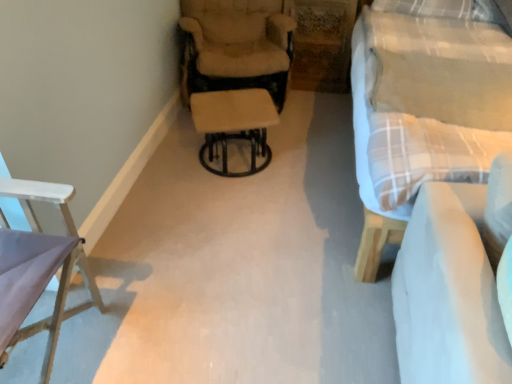
At what (x,y) coordinates should I click in order to perform the action: click on vacant space in front of black metal stool at center. Please return your answer as a coordinate pair (x, y). Looking at the image, I should click on (234, 208).